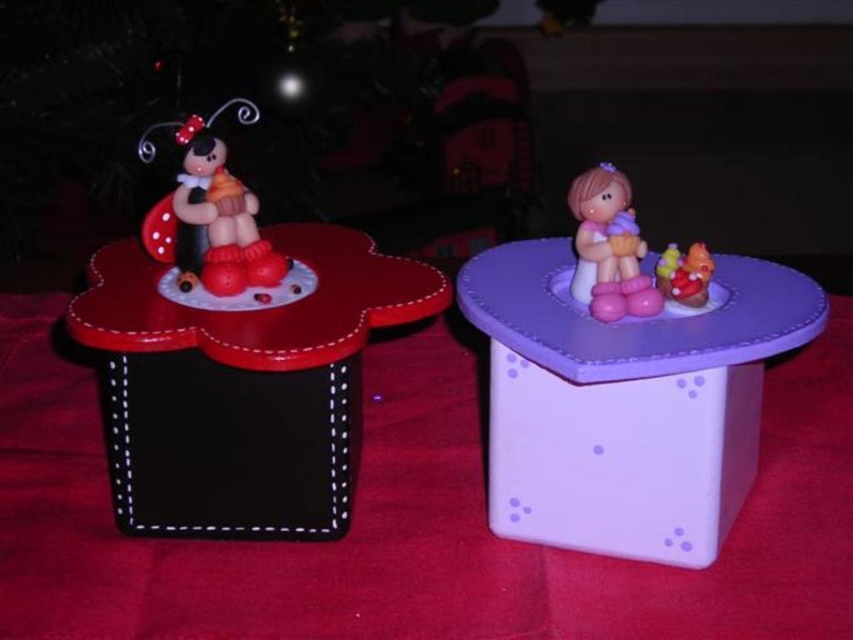
Where is `purple plastic table at upper center`? Image resolution: width=853 pixels, height=640 pixels. purple plastic table at upper center is located at coordinates (625, 403).

Is the position of purple plastic table at upper center more distant than that of pink rubber duck at upper right?

No, purple plastic table at upper center is in front of pink rubber duck at upper right.

Which is in front, point (579, 429) or point (688, 288)?

Point (579, 429)

This screenshot has height=640, width=853. Find the location of `purple plastic table at upper center`. purple plastic table at upper center is located at coordinates (625, 403).

Is matte black table at left smaller than pink matte doll at upper center?

Actually, matte black table at left might be larger than pink matte doll at upper center.

Which is more to the left, matte black table at left or pink matte doll at upper center?

matte black table at left

Does point (248, 413) come in front of point (605, 216)?

That is True.

This screenshot has width=853, height=640. Find the location of `matte black table at left`. matte black table at left is located at coordinates (242, 387).

Does purple plastic table at upper center have a lesser height compared to matte plastic ladybug at left?

No, purple plastic table at upper center is not shorter than matte plastic ladybug at left.

Can you confirm if purple plastic table at upper center is positioned above matte plastic ladybug at left?

Actually, purple plastic table at upper center is below matte plastic ladybug at left.

Who is more distant from viewer, (508, 518) or (234, 252)?

Positioned behind is point (234, 252).

You are a GUI agent. You are given a task and a screenshot of the screen. Output one action in this format:
    pyautogui.click(x=<x>, y=<y>)
    Task: Click on the purple plastic table at upper center
    
    Given the screenshot: What is the action you would take?
    coord(625,403)